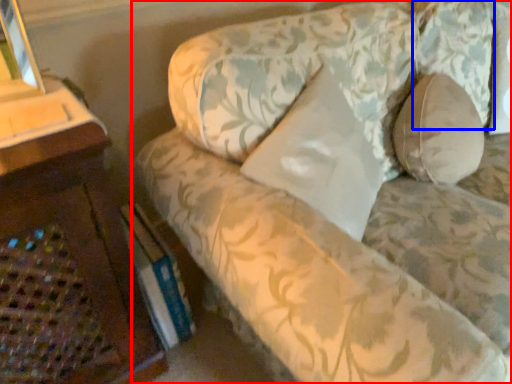
Question: Which of the following is the farthest to the observer, studio couch (highlighted by a red box) or pillow (highlighted by a blue box)?

Choices:
 (A) studio couch
 (B) pillow

Answer: (B)